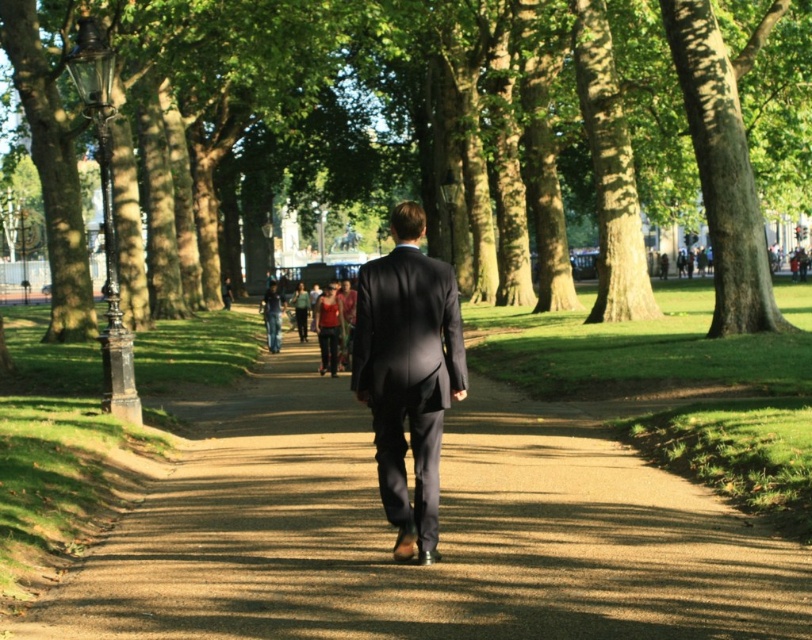
Is green leafy tree at center thinner than matte red shirt at center?

Incorrect, green leafy tree at center's width is not less than matte red shirt at center's.

Does green leafy tree at center have a greater width compared to matte red shirt at center?

Indeed, green leafy tree at center has a greater width compared to matte red shirt at center.

Who is more distant from viewer, (739,154) or (296,291)?

Positioned behind is point (296,291).

At what (x,y) coordinates should I click in order to perform the action: click on green leafy tree at center. Please return your answer as a coordinate pair (x, y). Image resolution: width=812 pixels, height=640 pixels. Looking at the image, I should click on (465, 118).

Who is positioned more to the right, brown gravel path at center or dark gray suit at center?

Positioned to the right is dark gray suit at center.

Is brown gravel path at center smaller than dark gray suit at center?

No, brown gravel path at center is not smaller than dark gray suit at center.

Image resolution: width=812 pixels, height=640 pixels. I want to click on brown gravel path at center, so click(x=439, y=534).

From the picture: Which is above, green leafy tree at center or brown gravel path at center?

green leafy tree at center is above.

Which is in front, point (622, 96) or point (296, 428)?

Point (296, 428) is in front.

Does point (357, 131) come closer to viewer compared to point (473, 403)?

No, it is behind (473, 403).

The height and width of the screenshot is (640, 812). What are the coordinates of `green leafy tree at center` in the screenshot? It's located at (465, 118).